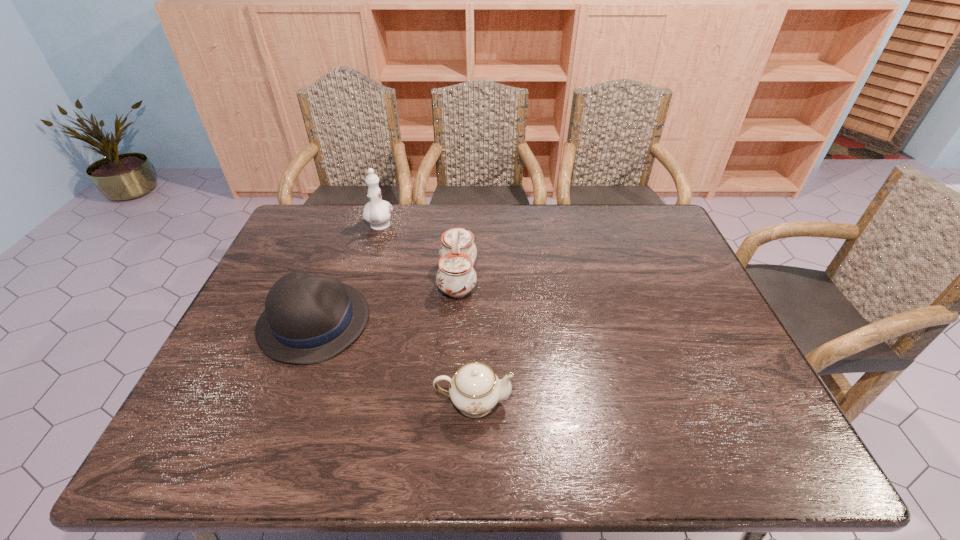
This screenshot has width=960, height=540. What are the coordinates of `object at the far edge` in the screenshot? It's located at (377, 212).

Where is `object situated at the left edge`? object situated at the left edge is located at coordinates (308, 319).

In the image, there is a desktop. Identify the location of vacant space at the far edge. (569, 224).

Locate an element on the screen. The height and width of the screenshot is (540, 960). free space at the near edge of the desktop is located at coordinates (343, 432).

Where is `vacant space at the right edge of the desktop`? This screenshot has width=960, height=540. vacant space at the right edge of the desktop is located at coordinates (708, 354).

In the image, there is a desktop. Identify the location of vacant space at the far left corner. (330, 225).

At what (x,y) coordinates should I click in order to perform the action: click on vacant space at the far right corner of the desktop. Please return your answer as a coordinate pair (x, y). This screenshot has height=540, width=960. Looking at the image, I should click on (650, 223).

Find the location of `free spot between the tallest object and the nearest object`. free spot between the tallest object and the nearest object is located at coordinates (426, 314).

This screenshot has height=540, width=960. I want to click on free area in between the farthest object and the third tallest object, so click(347, 274).

Locate an element on the screen. The width and height of the screenshot is (960, 540). unoccupied position between the second shortest object and the shortest chinaware is located at coordinates [x=394, y=362].